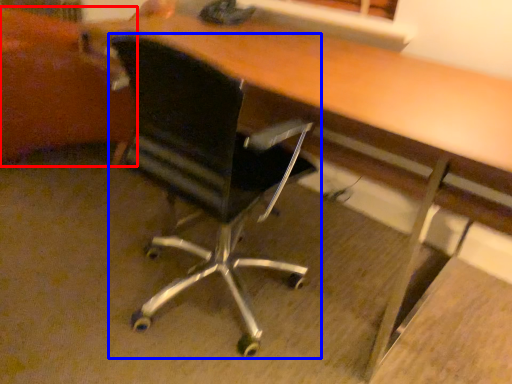
Question: Which object appears closest to the camera in this image, swivel chair (highlighted by a red box) or chair (highlighted by a blue box)?

Choices:
 (A) swivel chair
 (B) chair

Answer: (B)